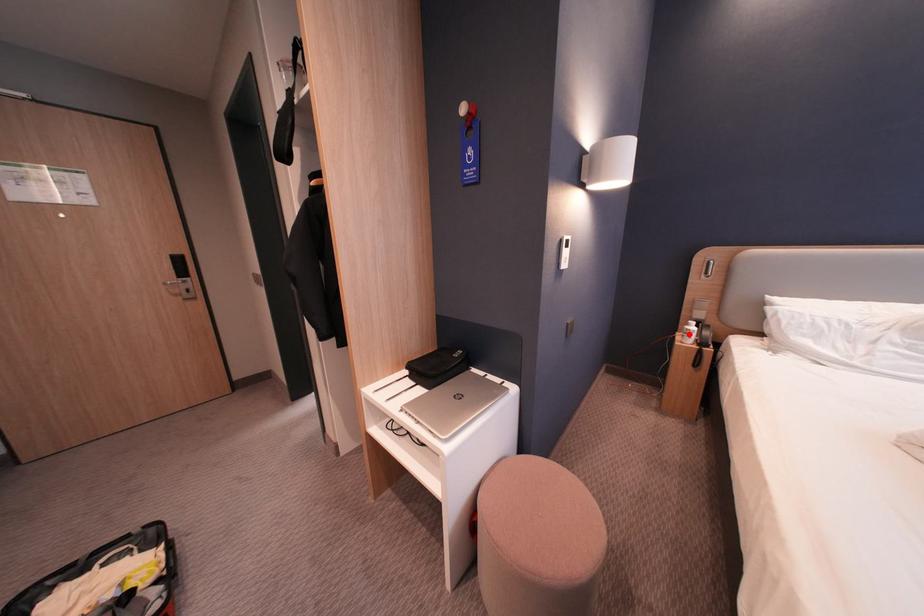
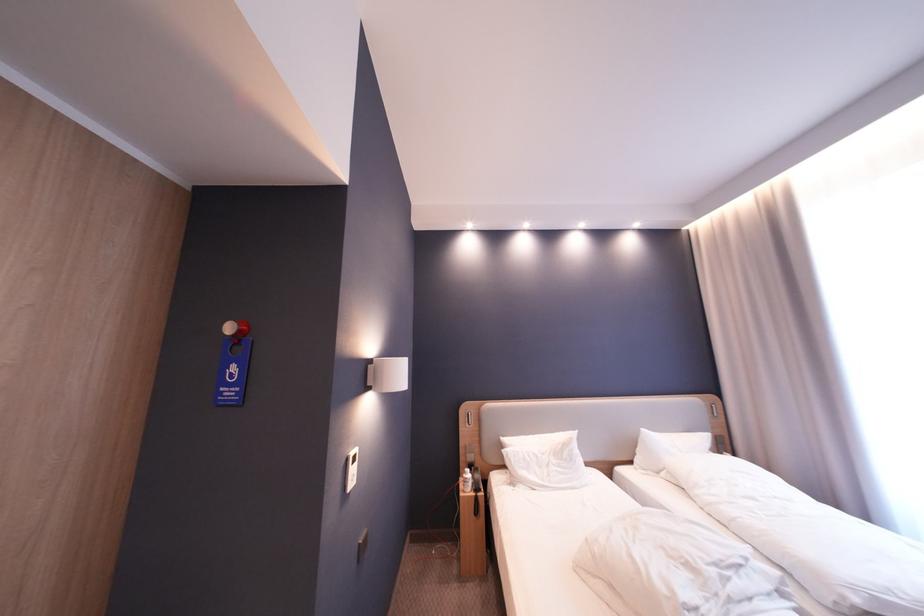
Question: A red point is marked in image1. In image2, is the corresponding 3D point closer to the camera or farther? Reply with the corresponding letter.

Choices:
 (A) The corresponding 3D point is closer.
 (B) The corresponding 3D point is farther.

Answer: (B)